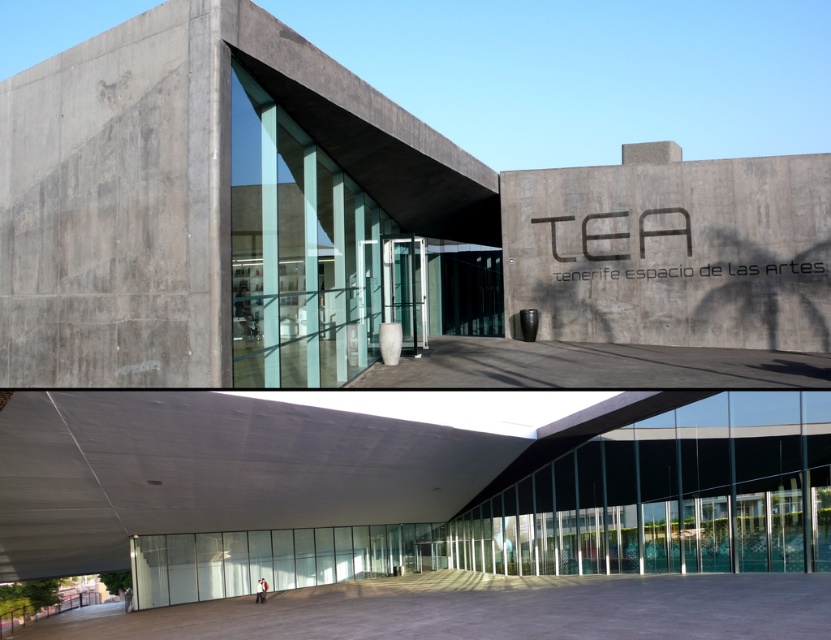
You are standing in front of the TEA building and see the concrete textured wall at center and the light gray concrete person at center. Which object is closer to you?

The concrete textured wall at center is closer to the viewer than the light gray concrete person at center.

You are standing in front of the TEA building and want to determine the relative positions of two points marked on its facade. The points are labeled as point 1 at coordinates point (70, 624) and point 2 at coordinates point (259, 582). Which point is closer to you?

Point 1 at coordinates point (70, 624) is closer to you because it is further to the viewer than point 2 at coordinates point (259, 582).